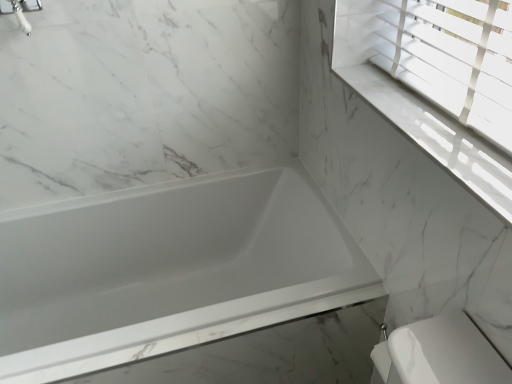
Question: Can you confirm if white glossy bathtub at center is wider than white marble window sill at upper right?

Choices:
 (A) no
 (B) yes

Answer: (B)

Question: Would you say white marble window sill at upper right is part of white glossy bathtub at center's contents?

Choices:
 (A) yes
 (B) no

Answer: (B)

Question: Considering the relative sizes of white glossy bathtub at center and white marble window sill at upper right in the image provided, is white glossy bathtub at center shorter than white marble window sill at upper right?

Choices:
 (A) no
 (B) yes

Answer: (A)

Question: Is white glossy bathtub at center facing towards white marble window sill at upper right?

Choices:
 (A) yes
 (B) no

Answer: (B)

Question: Is white glossy bathtub at center with white marble window sill at upper right?

Choices:
 (A) no
 (B) yes

Answer: (A)

Question: Considering the positions of point (490, 177) and point (1, 8), is point (490, 177) closer or farther from the camera than point (1, 8)?

Choices:
 (A) farther
 (B) closer

Answer: (B)

Question: Considering the positions of white marble window sill at upper right and silver metallic faucet at upper left in the image, is white marble window sill at upper right bigger or smaller than silver metallic faucet at upper left?

Choices:
 (A) small
 (B) big

Answer: (A)

Question: Would you say white marble window sill at upper right is inside or outside silver metallic faucet at upper left?

Choices:
 (A) outside
 (B) inside

Answer: (A)

Question: From their relative heights in the image, would you say white marble window sill at upper right is taller or shorter than silver metallic faucet at upper left?

Choices:
 (A) short
 (B) tall

Answer: (A)

Question: From a real-world perspective, is white glossy bathtub at center positioned above or below silver metallic faucet at upper left?

Choices:
 (A) above
 (B) below

Answer: (B)

Question: Based on their sizes in the image, would you say white glossy bathtub at center is bigger or smaller than silver metallic faucet at upper left?

Choices:
 (A) small
 (B) big

Answer: (B)

Question: Looking at their shapes, would you say white glossy bathtub at center is wider or thinner than silver metallic faucet at upper left?

Choices:
 (A) wide
 (B) thin

Answer: (A)

Question: Is white glossy bathtub at center taller or shorter than silver metallic faucet at upper left?

Choices:
 (A) tall
 (B) short

Answer: (A)

Question: Considering the positions of white marble window sill at upper right and white glossy bathtub at center in the image, is white marble window sill at upper right bigger or smaller than white glossy bathtub at center?

Choices:
 (A) big
 (B) small

Answer: (B)

Question: In terms of height, does white marble window sill at upper right look taller or shorter compared to white glossy bathtub at center?

Choices:
 (A) tall
 (B) short

Answer: (B)